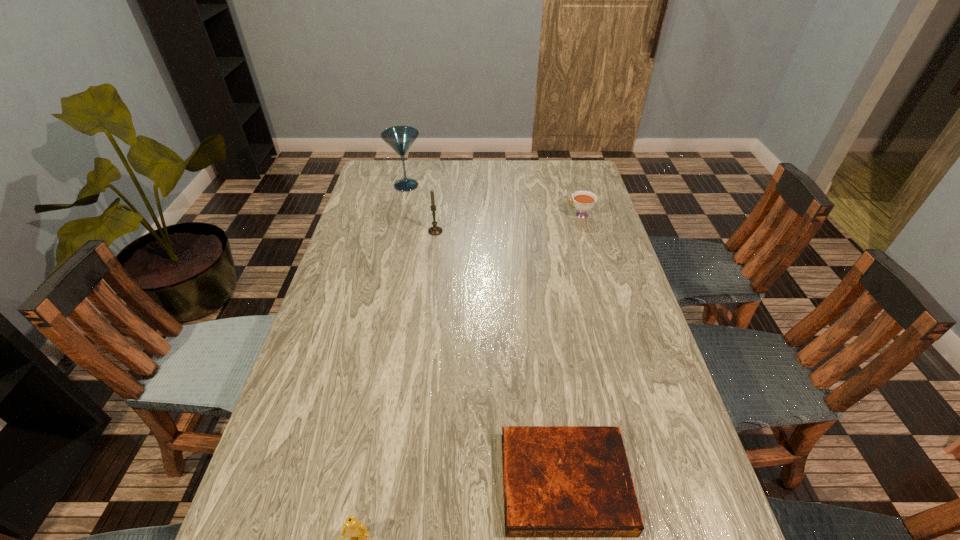
Identify the location of free space located 0.390m on the side of the rightmost object with the handle. (458, 214).

I want to click on vacant space located 0.180m on the side of the rightmost object with the handle, so click(x=516, y=214).

At what (x,y) coordinates should I click in order to perform the action: click on free space located 0.090m on the side of the rightmost object with the handle. Please return your answer as a coordinate pair (x, y). The width and height of the screenshot is (960, 540). Looking at the image, I should click on (541, 214).

Find the location of a particular element. This screenshot has height=540, width=960. object positioned at the far edge is located at coordinates (400, 138).

The height and width of the screenshot is (540, 960). What are the coordinates of `object positioned at the left edge` in the screenshot? It's located at (400, 138).

You are a GUI agent. You are given a task and a screenshot of the screen. Output one action in this format:
    pyautogui.click(x=<x>, y=<y>)
    Task: Click on the teacup positioned at the right edge
    The width and height of the screenshot is (960, 540).
    Given the screenshot: What is the action you would take?
    pyautogui.click(x=583, y=201)

You are a GUI agent. You are given a task and a screenshot of the screen. Output one action in this format:
    pyautogui.click(x=<x>, y=<y>)
    Task: Click on the Bible present at the right edge
    
    Given the screenshot: What is the action you would take?
    pyautogui.click(x=559, y=481)

The height and width of the screenshot is (540, 960). Identify the location of object positioned at the far left corner. click(x=400, y=138).

This screenshot has height=540, width=960. Identify the location of vacant space at the far edge of the desktop. tap(501, 177).

You are a GUI agent. You are given a task and a screenshot of the screen. Output one action in this format:
    pyautogui.click(x=<x>, y=<y>)
    Task: Click on the vacant space at the left edge
    The height and width of the screenshot is (540, 960).
    Given the screenshot: What is the action you would take?
    pyautogui.click(x=319, y=438)